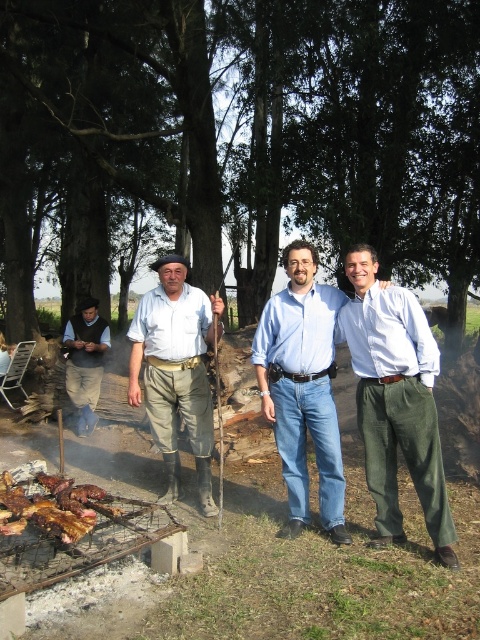
Question: Which point is farther to the camera?

Choices:
 (A) tap(291, 499)
 (B) tap(385, 381)

Answer: (A)

Question: Can you confirm if matte khaki pants at center is positioned below brown charred meat at lower left?

Choices:
 (A) no
 (B) yes

Answer: (A)

Question: Considering the real-world distances, which object is farthest from the matte khaki pants at center?

Choices:
 (A) brown charred meat at lower left
 (B) matte blue shirt at center
 (C) light brown leather vest at left

Answer: (C)

Question: Can you confirm if matte blue shirt at center is positioned above brown charred meat at lower left?

Choices:
 (A) yes
 (B) no

Answer: (A)

Question: Observing the image, what is the correct spatial positioning of matte khaki pants at center in reference to light brown leather vest at left?

Choices:
 (A) right
 (B) left

Answer: (A)

Question: Among these objects, which one is nearest to the camera?

Choices:
 (A) matte blue shirt at center
 (B) matte khaki pants at center
 (C) brown charred meat at lower left

Answer: (C)